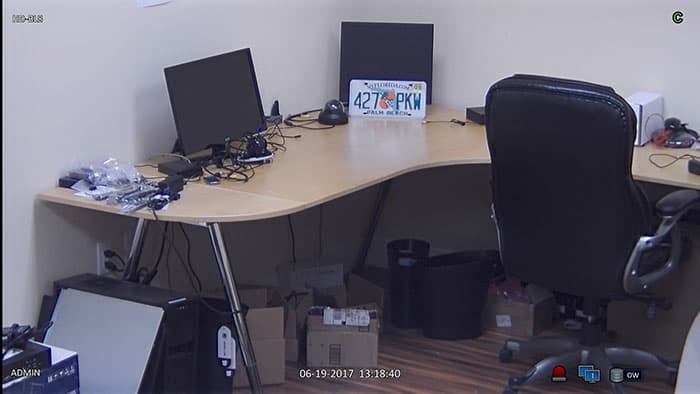
The image size is (700, 394). Find the location of `computer tower`. computer tower is located at coordinates (190, 326).